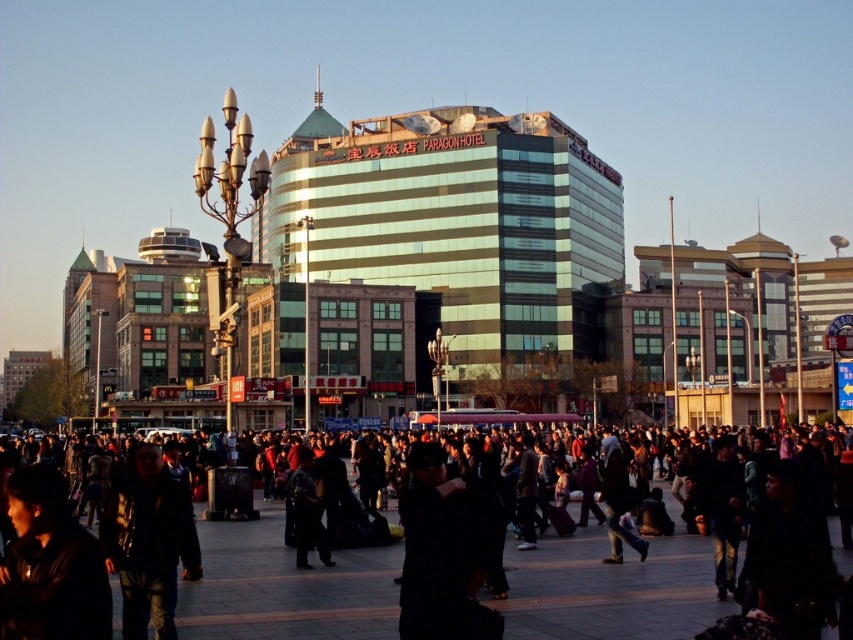
You are a photographer trying to capture a clear shot of the PARAGON HOTEL sign. You are standing at the lower left corner of the image. There are two obstacles in your view. One is the black matte crowd at center and the other is the dark blue leather jacket at lower left. Which obstacle is closer to you?

The dark blue leather jacket at lower left is closer to you since it is at the lower left corner where you are standing, while the black matte crowd at center is farther away in the central area of the plaza.

You are a photographer standing in the plaza in front of the PARAGON HOTEL. You notice two jackets in the crowd. The black matte jacket at center and the dark blue leather jacket at lower left. Which jacket is covering part of the other?

The black matte jacket at center is positioned over the dark blue leather jacket at lower left, so it is covering part of it.

You are standing in the plaza in front of the PARAGON HOTEL and notice two jackets. The dark blue leather jacket at lower left and the dark gray fabric jacket at center. Which jacket is nearer to you?

The dark blue leather jacket at lower left is closer to the viewer than the dark gray fabric jacket at center.